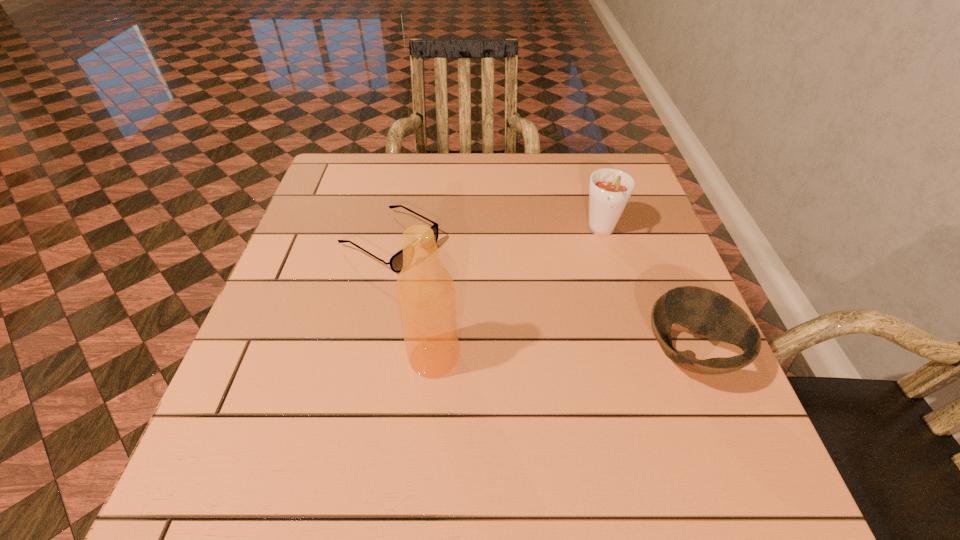
This screenshot has width=960, height=540. I want to click on vacant point located on the front-facing side of the spectacles, so click(576, 348).

I want to click on vacant space situated 0.270m on the front-facing side of the spectacles, so click(524, 319).

Where is `object situated at the near edge`? This screenshot has width=960, height=540. object situated at the near edge is located at coordinates (705, 312).

Identify the location of object at the left edge. (396, 262).

You are a GUI agent. You are given a task and a screenshot of the screen. Output one action in this format:
    pyautogui.click(x=<x>, y=<y>)
    Task: Click on the bowl present at the right edge
    
    Given the screenshot: What is the action you would take?
    pyautogui.click(x=705, y=312)

The image size is (960, 540). Find the location of `root beer present at the right edge`. root beer present at the right edge is located at coordinates (610, 189).

This screenshot has height=540, width=960. Identify the location of object present at the near right corner. (705, 312).

In the image, there is a desktop. At what (x,y) coordinates should I click in order to perform the action: click on free space at the far edge. Please return your answer as a coordinate pair (x, y). This screenshot has height=540, width=960. Looking at the image, I should click on (549, 200).

The image size is (960, 540). In the image, there is a desktop. In order to click on free region at the near edge in this screenshot , I will do `click(450, 406)`.

I want to click on vacant space at the left edge of the desktop, so click(301, 383).